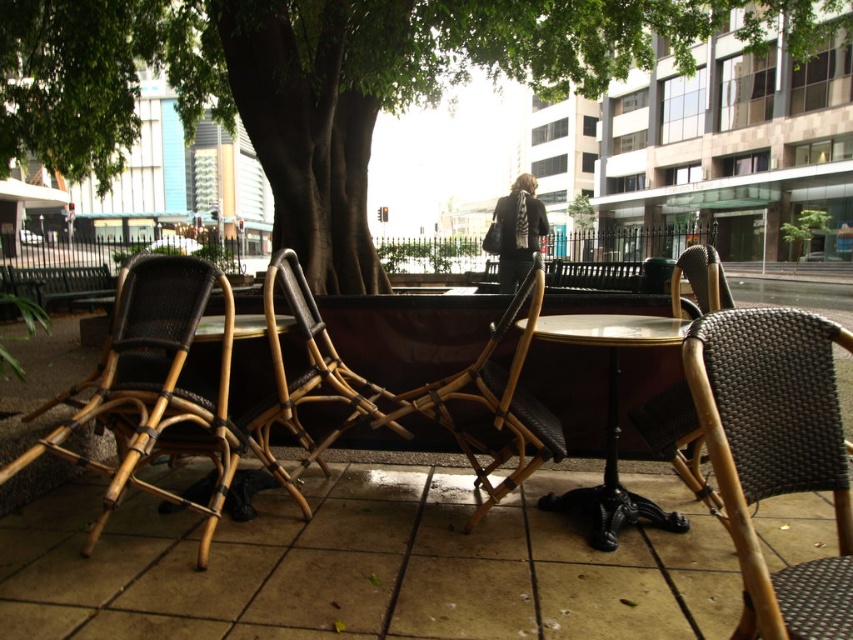
You are a customer at this outdoor seating area and want to sit in a chair that allows more space for your legs. Which chair between the woven rattan chair at right and the bamboo wicker chair at left would you choose?

The bamboo wicker chair at left has a greater width than the woven rattan chair at right, so it allows more space for your legs.

You are a maintenance worker who needs to clean the brown tile pavement at center and the bamboo wicker chair at center. You have a 12 inch wide cleaning tool. Can you fit the tool between them without touching either object?

The brown tile pavement at center and bamboo wicker chair at center are 13.03 inches apart. Since the tool is 12 inches wide, it can fit between them as the space is wider than the tool.

You are standing at the center of the outdoor seating area and want to move to the bamboo wicker chair at left. Which direction should you walk to reach it?

You should walk to the left to reach the bamboo wicker chair at left since its 2D location is at point (155,387), indicating it is positioned to the left side of the scene.